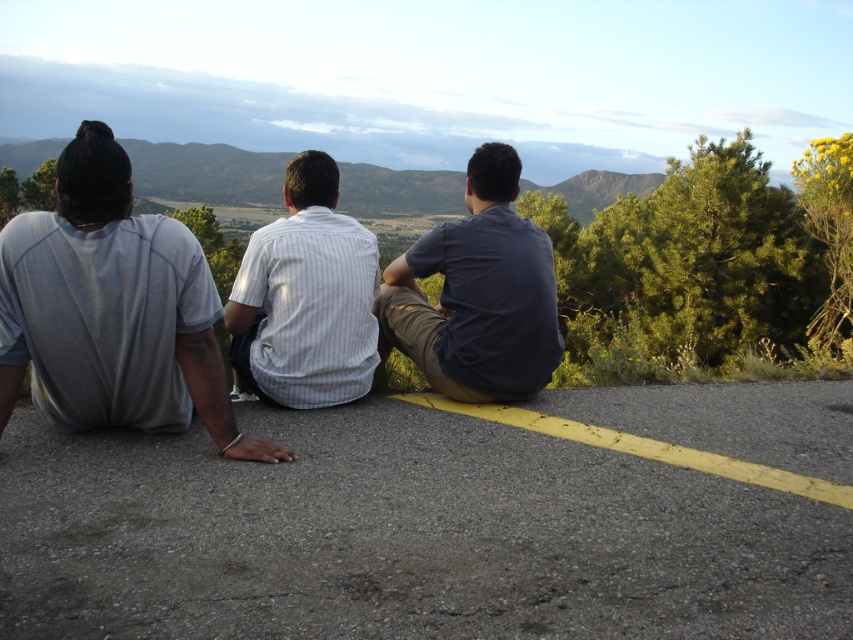
Looking at this image, you are a photographer trying to capture a group photo of the dark blue shirt at center and the white striped shirt at center. The camera can only focus on one person at a time. Which person should you focus on first to ensure the larger subject is in focus?

The dark blue shirt at center is larger in size than the white striped shirt at center, so you should focus on the dark blue shirt at center first to ensure the larger subject is in focus.

You are a photographer wanting to capture a group photo of the dark blue shirt at center and the white striped shirt at center. Since you want to ensure both subjects are clearly visible, which subject should you focus on to account for their size difference?

The dark blue shirt at center is wider than the white striped shirt at center, so focusing on the dark blue shirt at center would ensure both are clearly visible due to its larger size.